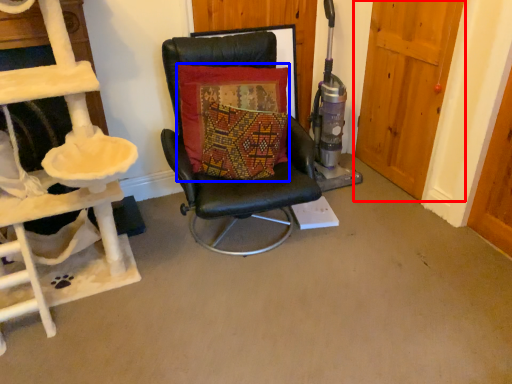
Question: Which of the following is the closest to the observer, door (highlighted by a red box) or pillow (highlighted by a blue box)?

Choices:
 (A) door
 (B) pillow

Answer: (B)